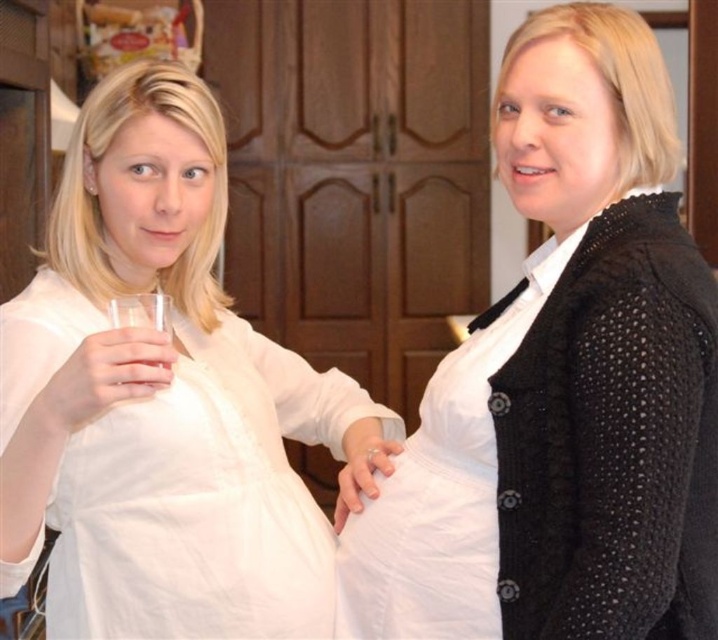
Question: Does white cotton shirt at left appear on the right side of clear glass at center?

Choices:
 (A) no
 (B) yes

Answer: (B)

Question: Does white cotton shirt at left come behind clear glass at center?

Choices:
 (A) yes
 (B) no

Answer: (B)

Question: Which point is farther to the camera?

Choices:
 (A) (381, 596)
 (B) (55, 381)
 (C) (164, 365)

Answer: (A)

Question: Which of these objects is positioned farthest from the white cotton shirt at left?

Choices:
 (A) white matte shirt at center
 (B) clear glass at center

Answer: (A)

Question: Can you confirm if white matte shirt at center is wider than white cotton shirt at left?

Choices:
 (A) yes
 (B) no

Answer: (B)

Question: Which object is positioned closest to the white matte shirt at center?

Choices:
 (A) white cotton shirt at left
 (B) clear glass at center

Answer: (A)